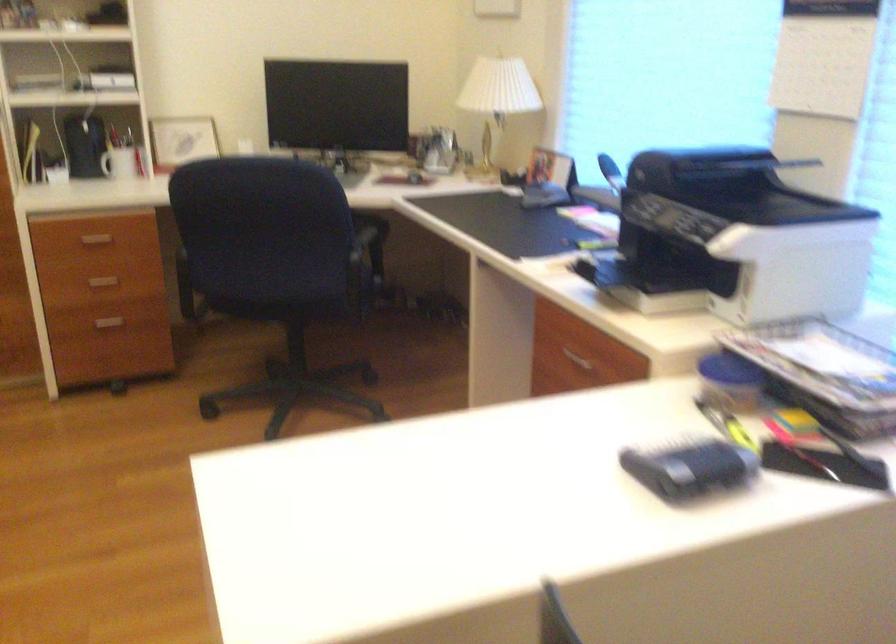
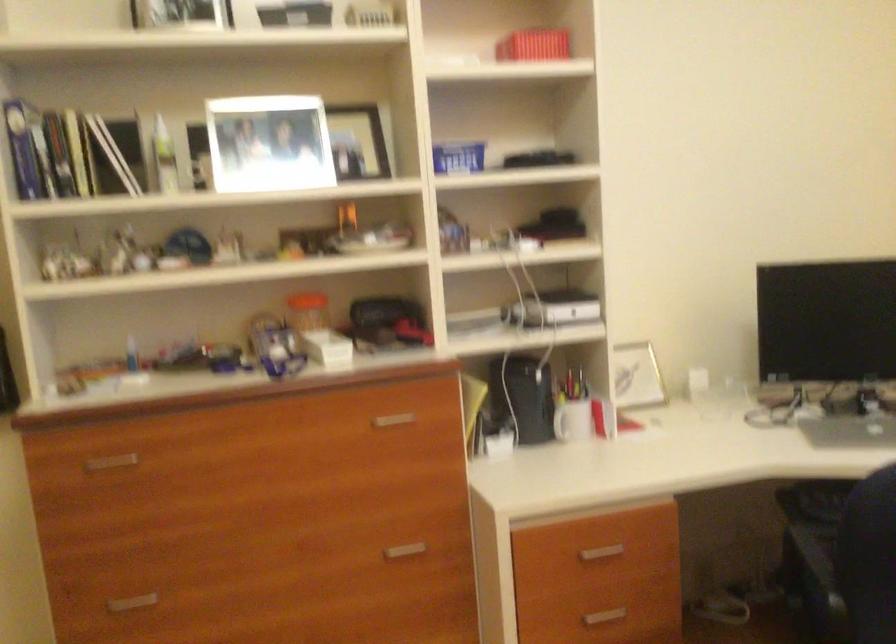
Where in the second image is the point corresponding to (x=88, y=240) from the first image?

(600, 553)